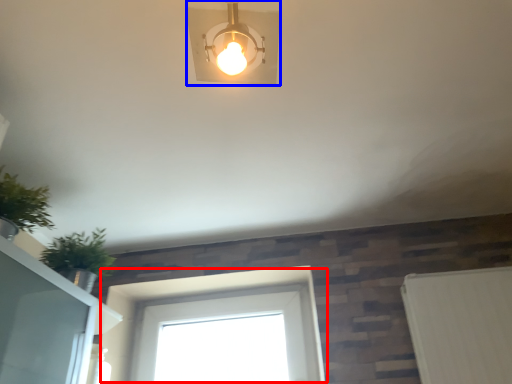
Question: Which of the following is the farthest to the observer, window (highlighted by a red box) or lamp (highlighted by a blue box)?

Choices:
 (A) window
 (B) lamp

Answer: (A)